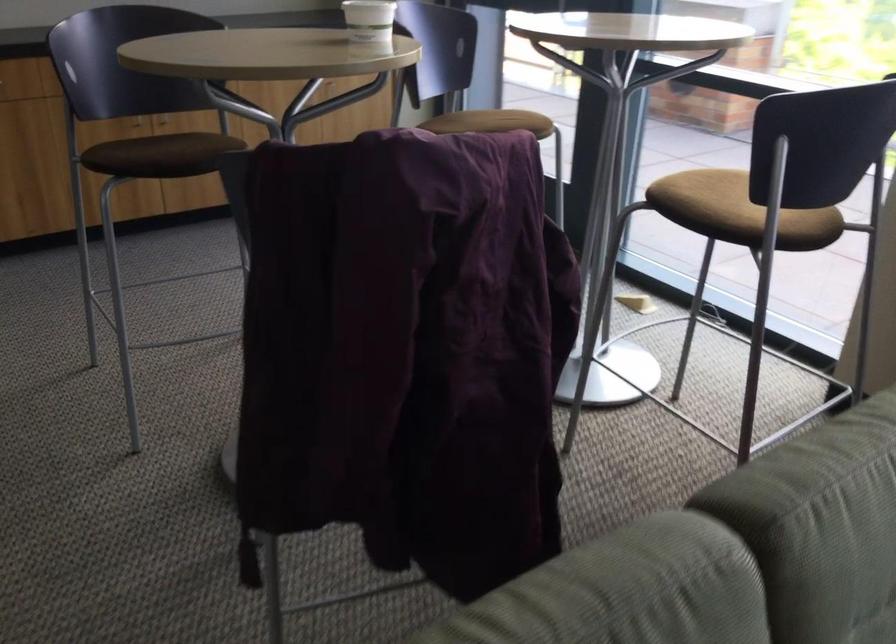
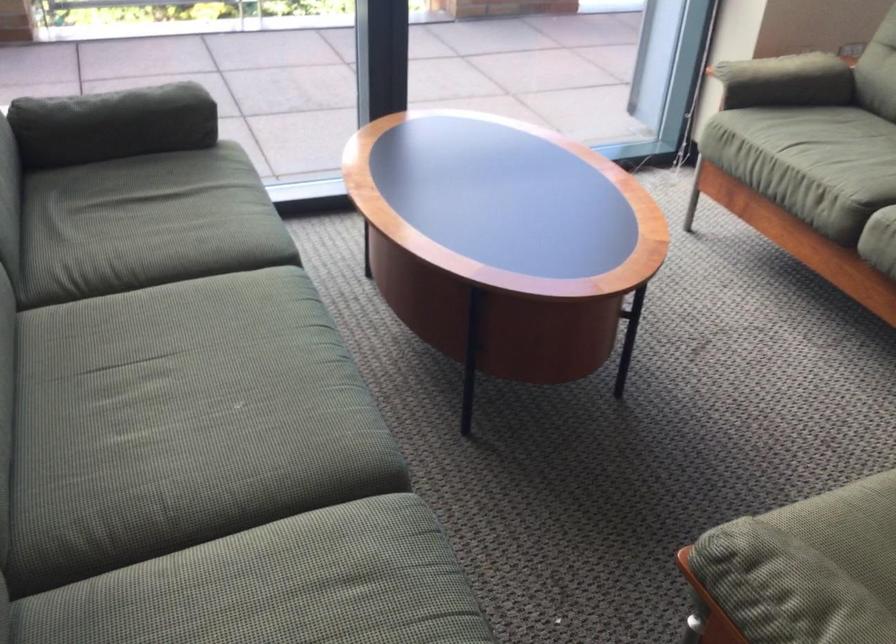
How did the camera likely rotate?

The camera rotated toward right-down.